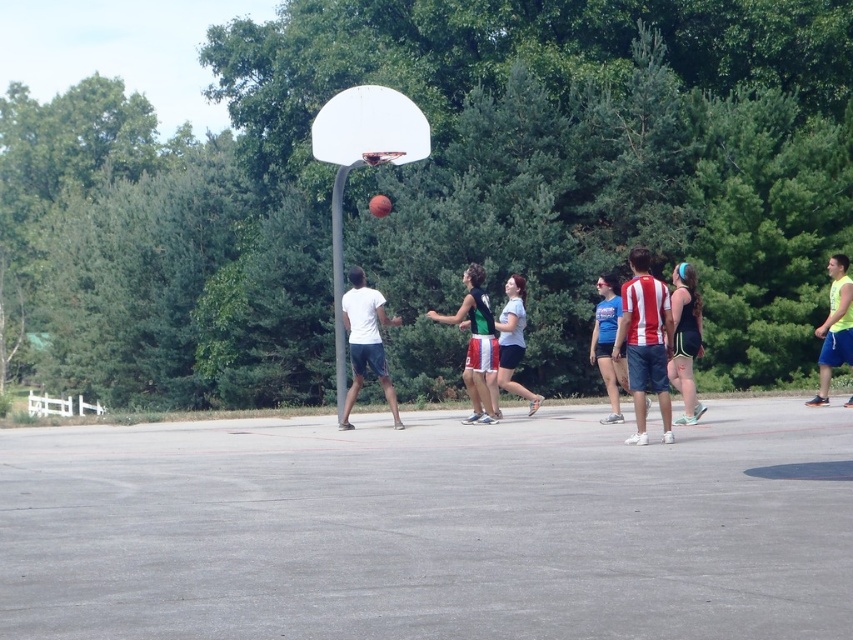
Who is taller, gray concrete court at center or green jersey at center?

green jersey at center

Consider the image. Who is more distant from viewer, (x=473, y=445) or (x=473, y=410)?

The point (x=473, y=410) is behind.

Who is more forward, (828, 454) or (473, 412)?

Point (828, 454) is more forward.

Where is `gray concrete court at center`? The height and width of the screenshot is (640, 853). gray concrete court at center is located at coordinates (431, 529).

Based on the photo, between white matte basketball hoop at center and matte black tank top at center, which one appears on the left side from the viewer's perspective?

white matte basketball hoop at center

Is white matte basketball hoop at center closer to camera compared to matte black tank top at center?

No, it is behind matte black tank top at center.

Where is `white matte basketball hoop at center`? The height and width of the screenshot is (640, 853). white matte basketball hoop at center is located at coordinates (363, 163).

Who is taller, striped jersey shorts at center or white matte t-shirt at center?

striped jersey shorts at center is taller.

Which is in front, point (631, 346) or point (393, 413)?

Point (631, 346) is more forward.

Between point (666, 404) and point (369, 364), which one is positioned behind?

Positioned behind is point (369, 364).

Identify the location of striped jersey shorts at center. (645, 342).